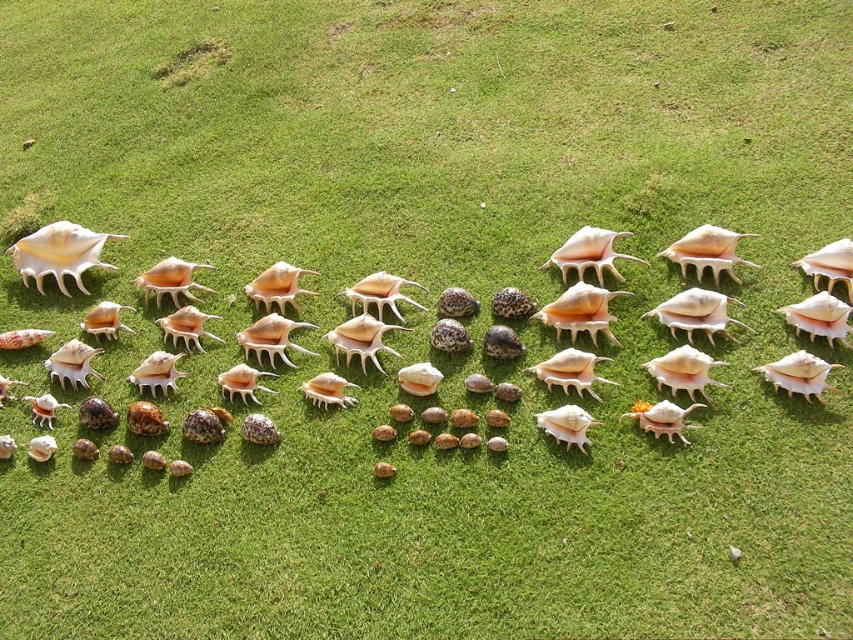
You are standing in a garden and see the translucent white seashell at center and the matte white shell at upper left. Which seashell is positioned more to the right?

The translucent white seashell at center is positioned more to the right than the matte white shell at upper left.

You are looking at the arrangement of seashells on the grass. There is a translucent white seashell at center and a shiny beige seashell at center. Which one is positioned to the left?

The translucent white seashell at center is to the left of the shiny beige seashell at center.

From the picture: You are a child trying to stack the matte white shell at upper left and the shiny beige seashell at center. Which shell should you place at the bottom to make the stack stable?

The matte white shell at upper left is taller than the shiny beige seashell at center, so you should place the matte white shell at upper left at the bottom to make the stack stable because taller shells provide a more stable base.